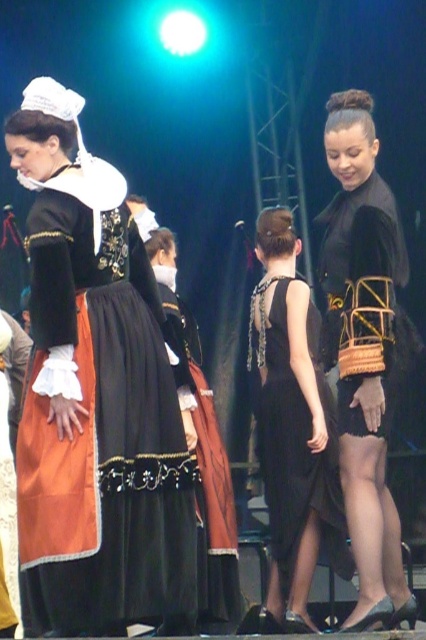
Question: Among these points, which one is farthest from the camera?

Choices:
 (A) (206, 512)
 (B) (377, 193)
 (C) (330, 518)

Answer: (A)

Question: Which point appears farthest from the camera in this image?

Choices:
 (A) (195, 396)
 (B) (382, 465)

Answer: (A)

Question: Is black matte dress at center smaller than black satin dress at center?

Choices:
 (A) yes
 (B) no

Answer: (A)

Question: Is black matte dress at center in front of matte black dress at center?

Choices:
 (A) yes
 (B) no

Answer: (A)

Question: Which point appears closest to the camera in this image?

Choices:
 (A) [146, 376]
 (B) [273, 422]
 (C) [336, 236]
 (D) [345, 216]

Answer: (A)

Question: Is black satin dress at center in front of black woven basket at center?

Choices:
 (A) no
 (B) yes

Answer: (A)